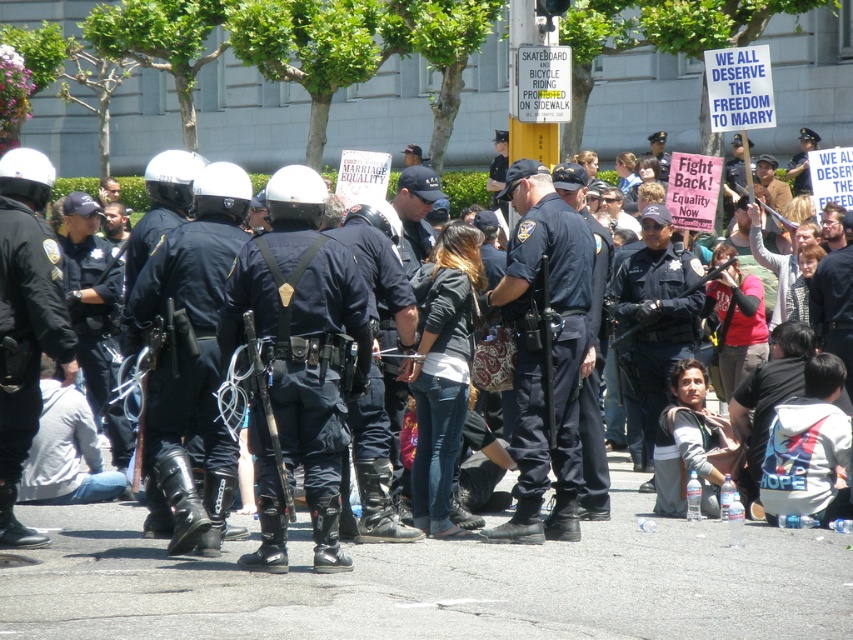
Question: Does black leather helmet at center appear on the right side of black matte uniform at center?

Choices:
 (A) yes
 (B) no

Answer: (A)

Question: Which object appears closest to the camera in this image?

Choices:
 (A) black uniformed officer at center
 (B) matte black helmet at center
 (C) matte black helmet at left

Answer: (B)

Question: Which object is positioned farthest from the matte black helmet at left?

Choices:
 (A) dark blue uniform at center
 (B) black matte uniform at center
 (C) black leather helmet at center

Answer: (A)

Question: Is black leather helmet at center below black uniformed officer at center?

Choices:
 (A) no
 (B) yes

Answer: (B)

Question: Which point is closer to the camera?

Choices:
 (A) (273, 460)
 (B) (517, 529)

Answer: (A)

Question: Does black leather helmet at center appear on the left side of black uniformed officer at center?

Choices:
 (A) no
 (B) yes

Answer: (B)